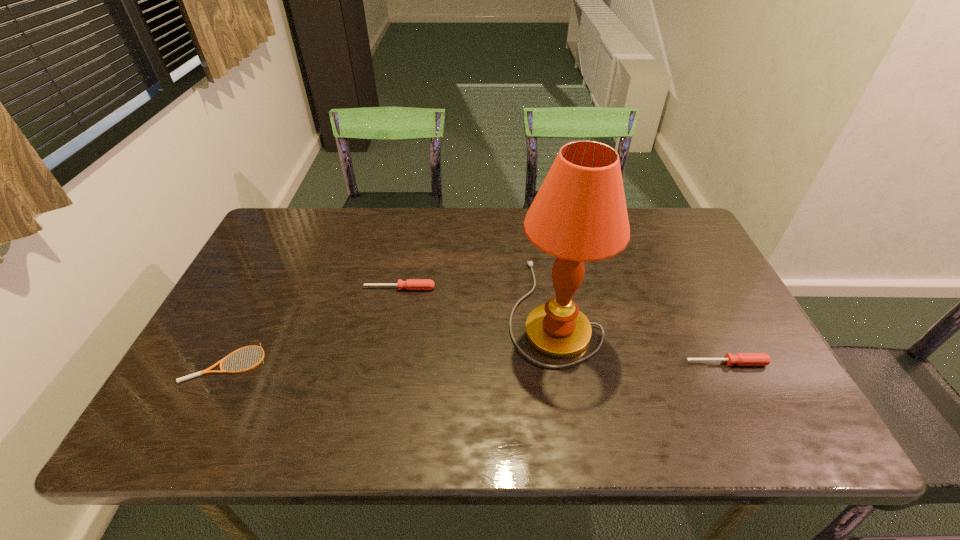
Where is `vacant area situated on the front of the right screwdriver`? vacant area situated on the front of the right screwdriver is located at coordinates (752, 414).

Identify the location of free space located 0.110m on the front of the leftmost object. This screenshot has height=540, width=960. coord(193,429).

Find the location of a particular element. The height and width of the screenshot is (540, 960). object that is at the left edge is located at coordinates (221, 361).

Where is `object at the right edge`? This screenshot has width=960, height=540. object at the right edge is located at coordinates (741, 359).

This screenshot has height=540, width=960. In the image, there is a desktop. Find the location of `free space at the far edge`. free space at the far edge is located at coordinates (345, 251).

Identify the location of vacant space at the near edge of the desktop. (416, 410).

Locate an element on the screen. The width and height of the screenshot is (960, 540). free space at the left edge of the desktop is located at coordinates (239, 292).

I want to click on free space at the far right corner, so click(x=654, y=224).

At what (x,y) coordinates should I click in order to perform the action: click on vacant space that's between the tallest object and the rightmost object. Please return your answer as a coordinate pair (x, y). Looking at the image, I should click on (639, 336).

Image resolution: width=960 pixels, height=540 pixels. Identify the location of empty space that is in between the shortest object and the nearer screwdriver. (476, 363).